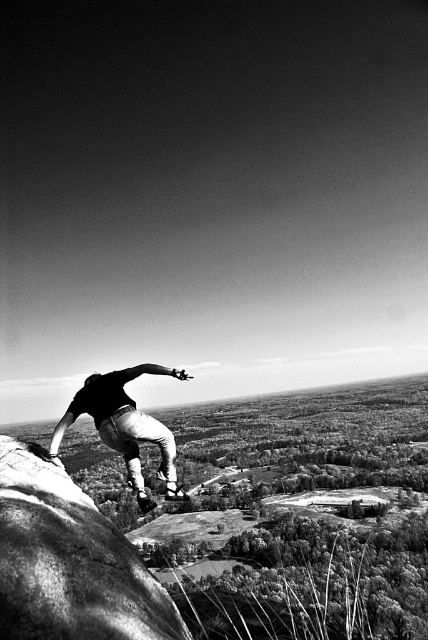
You are a photographer analyzing the composition of this image. You notice the smooth black skateboard at center and the metallic silver skateboard at lower center. Which skateboard takes up more visual space in the photo?

The metallic silver skateboard at lower center occupies more visual space than the smooth black skateboard at center.

From the picture: You are a photographer analyzing the composition of this image. You notice two skateboards in the scene. Which skateboard, the smooth black skateboard at center or the metallic silver skateboard at lower center, is positioned higher in the frame?

The smooth black skateboard at center is positioned higher in the frame than the metallic silver skateboard at lower center.